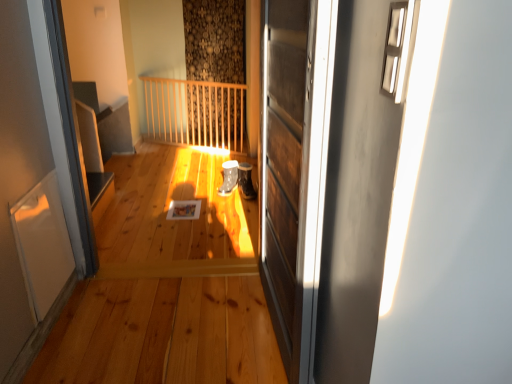
Measure the distance between point (281, 71) and camera.

Point (281, 71) is 4.76 feet away from camera.

Identify the location of wooden panelled door at center. This screenshot has height=384, width=512. (292, 168).

The width and height of the screenshot is (512, 384). Describe the element at coordinates (292, 168) in the screenshot. I see `wooden panelled door at center` at that location.

What is the approximate width of wooden panelled door at center?

wooden panelled door at center is 3.76 inches wide.

Image resolution: width=512 pixels, height=384 pixels. Find the location of `wooden panelled door at center`. wooden panelled door at center is located at coordinates (292, 168).